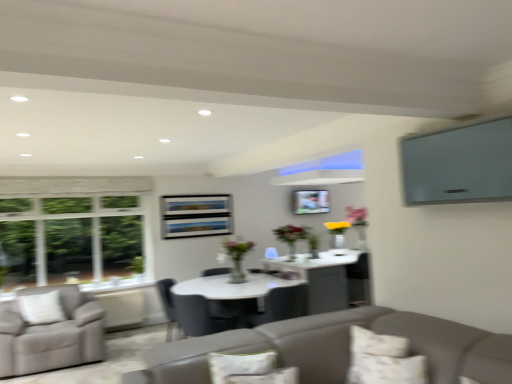
How much space does matte gray chair at center, which ranks as the 1th chair in right-to-left order, occupy horizontally?

It is 25.69 inches.

What is the approximate height of white textured pillow at lower right, which is the 1th pillow from right to left?

white textured pillow at lower right, which is the 1th pillow from right to left, is 11.19 inches tall.

In order to face matte black chair at center, the second chair when ordered from right to left, should I rotate leftwards or rightwards?

It's best to rotate left around 7.251 degrees.

You are a GUI agent. You are given a task and a screenshot of the screen. Output one action in this format:
    pyautogui.click(x=<x>, y=<y>)
    Task: Click on the fluffy white pillow at lower center, marked as the first pillow in a left-to-right arrangement
    Image resolution: width=512 pixels, height=384 pixels.
    Given the screenshot: What is the action you would take?
    pyautogui.click(x=266, y=377)

Is matte gray chair at center, which ranks as the 1th chair in right-to-left order, to the left or to the right of matte black chair at center, the second chair when ordered from right to left, in the image?

Clearly, matte gray chair at center, which ranks as the 1th chair in right-to-left order, is on the right of matte black chair at center, the second chair when ordered from right to left, in the image.

Locate an element on the screen. Image resolution: width=512 pixels, height=384 pixels. chair below the matte gray chair at center, which is counted as the second chair, starting from the left (from the image's perspective) is located at coordinates (191, 313).

Consider the image. Based on their sizes in the image, would you say matte gray chair at center, which ranks as the 1th chair in right-to-left order, is bigger or smaller than matte black chair at center, which is the first chair in left-to-right order?

matte gray chair at center, which ranks as the 1th chair in right-to-left order, is smaller than matte black chair at center, which is the first chair in left-to-right order.

Considering the positions of point (263, 314) and point (176, 295), is point (263, 314) closer or farther from the camera than point (176, 295)?

Point (263, 314) appears to be closer to the viewer than point (176, 295).

Is fluffy white pillow at lower center, arranged as the 2th pillow when viewed from the right, to the left of matte black chair at center, which is the first chair in left-to-right order, from the viewer's perspective?

Incorrect, fluffy white pillow at lower center, arranged as the 2th pillow when viewed from the right, is not on the left side of matte black chair at center, which is the first chair in left-to-right order.

Looking at this image, from a real-world perspective, which is physically below, fluffy white pillow at lower center, marked as the first pillow in a left-to-right arrangement, or matte black chair at center, the second chair when ordered from right to left?

From a 3D spatial view, matte black chair at center, the second chair when ordered from right to left, is below.

Is fluffy white pillow at lower center, arranged as the 2th pillow when viewed from the right, looking in the opposite direction of matte black chair at center, the second chair when ordered from right to left?

Yes, fluffy white pillow at lower center, arranged as the 2th pillow when viewed from the right, is positioned with its back facing matte black chair at center, the second chair when ordered from right to left.

Which object is closer to the camera, fluffy white pillow at lower center, marked as the first pillow in a left-to-right arrangement, or matte black chair at center, which is the first chair in left-to-right order?

fluffy white pillow at lower center, marked as the first pillow in a left-to-right arrangement, is more forward.

Is white textured pillow at lower right, which is the 1th pillow from right to left, surrounding matte black chair at center, which is the first chair in left-to-right order?

No, white textured pillow at lower right, which is the 1th pillow from right to left, does not contain matte black chair at center, which is the first chair in left-to-right order.

How different are the orientations of white textured pillow at lower right, which is the 1th pillow from right to left, and matte black chair at center, the second chair when ordered from right to left, in degrees?

169 degrees separate the facing orientations of white textured pillow at lower right, which is the 1th pillow from right to left, and matte black chair at center, the second chair when ordered from right to left.

I want to click on chair that is the 2nd object to the left of the white textured pillow at lower right, which is the 1th pillow from right to left, starting at the anchor, so click(x=191, y=313).

From a real-world perspective, is white textured pillow at lower right, which is the 1th pillow from right to left, under matte black chair at center, which is the first chair in left-to-right order?

Actually, white textured pillow at lower right, which is the 1th pillow from right to left, is physically above matte black chair at center, which is the first chair in left-to-right order, in the real world.

Is white textured pillow at lower right, the 2th pillow viewed from the left, far from matte gray chair at center, which ranks as the 1th chair in right-to-left order?

Indeed, white textured pillow at lower right, the 2th pillow viewed from the left, is not near matte gray chair at center, which ranks as the 1th chair in right-to-left order.

Which of these two, white textured pillow at lower right, which is the 1th pillow from right to left, or matte gray chair at center, which ranks as the 1th chair in right-to-left order, is smaller?

white textured pillow at lower right, which is the 1th pillow from right to left, is smaller.

Would you say white textured pillow at lower right, the 2th pillow viewed from the left, is inside or outside matte gray chair at center, which ranks as the 1th chair in right-to-left order?

white textured pillow at lower right, the 2th pillow viewed from the left, is not enclosed by matte gray chair at center, which ranks as the 1th chair in right-to-left order.

Which is more distant, (204, 299) or (293, 372)?

The point (204, 299) is farther.

Can you confirm if matte black chair at center, which is the first chair in left-to-right order, is positioned to the left of fluffy white pillow at lower center, arranged as the 2th pillow when viewed from the right?

Indeed, matte black chair at center, which is the first chair in left-to-right order, is positioned on the left side of fluffy white pillow at lower center, arranged as the 2th pillow when viewed from the right.

Considering the relative sizes of matte black chair at center, the second chair when ordered from right to left, and fluffy white pillow at lower center, arranged as the 2th pillow when viewed from the right, in the image provided, is matte black chair at center, the second chair when ordered from right to left, bigger than fluffy white pillow at lower center, arranged as the 2th pillow when viewed from the right,?

Indeed, matte black chair at center, the second chair when ordered from right to left, has a larger size compared to fluffy white pillow at lower center, arranged as the 2th pillow when viewed from the right.

From the image's perspective, which is below, matte black chair at center, which is the first chair in left-to-right order, or fluffy white pillow at lower center, marked as the first pillow in a left-to-right arrangement?

matte black chair at center, which is the first chair in left-to-right order.

Relative to white textured pillow at lower right, the 2th pillow viewed from the left, is matte black chair at center, which is the first chair in left-to-right order, in front or behind?

matte black chair at center, which is the first chair in left-to-right order, is behind white textured pillow at lower right, the 2th pillow viewed from the left.

Which is nearer, (198, 325) or (375, 350)?

The point (375, 350) is more forward.

Does matte black chair at center, the second chair when ordered from right to left, have a lesser height compared to white textured pillow at lower right, the 2th pillow viewed from the left?

In fact, matte black chair at center, the second chair when ordered from right to left, may be taller than white textured pillow at lower right, the 2th pillow viewed from the left.

Considering the sizes of matte black chair at center, which is the first chair in left-to-right order, and white textured pillow at lower right, which is the 1th pillow from right to left, in the image, is matte black chair at center, which is the first chair in left-to-right order, wider or thinner than white textured pillow at lower right, which is the 1th pillow from right to left,?

Clearly, matte black chair at center, which is the first chair in left-to-right order, has more width compared to white textured pillow at lower right, which is the 1th pillow from right to left.

Where is `pillow on the left side of white textured pillow at lower right, which is the 1th pillow from right to left`? The height and width of the screenshot is (384, 512). pillow on the left side of white textured pillow at lower right, which is the 1th pillow from right to left is located at coordinates (266, 377).

In the scene shown: From the image's perspective, is white textured pillow at lower right, which is the 1th pillow from right to left, above or below fluffy white pillow at lower center, arranged as the 2th pillow when viewed from the right?

white textured pillow at lower right, which is the 1th pillow from right to left, is below fluffy white pillow at lower center, arranged as the 2th pillow when viewed from the right.

Is white textured pillow at lower right, which is the 1th pillow from right to left, oriented away from fluffy white pillow at lower center, arranged as the 2th pillow when viewed from the right?

That's not correct — white textured pillow at lower right, which is the 1th pillow from right to left, is not looking away from fluffy white pillow at lower center, arranged as the 2th pillow when viewed from the right.

Considering the positions of objects white textured pillow at lower right, which is the 1th pillow from right to left, and fluffy white pillow at lower center, arranged as the 2th pillow when viewed from the right, in the image provided, who is more to the right, white textured pillow at lower right, which is the 1th pillow from right to left, or fluffy white pillow at lower center, arranged as the 2th pillow when viewed from the right,?

Positioned to the right is white textured pillow at lower right, which is the 1th pillow from right to left.

This screenshot has width=512, height=384. In order to click on chair above the matte black chair at center, the second chair when ordered from right to left (from the image's perspective) in this screenshot , I will do `click(282, 305)`.

Find the location of a particular element. This screenshot has height=384, width=512. the 2nd chair positioned below the fluffy white pillow at lower center, marked as the first pillow in a left-to-right arrangement (from a real-world perspective) is located at coordinates (191, 313).

Looking at the image, which one is located closer to matte gray chair at center, which ranks as the 1th chair in right-to-left order, matte black chair at center, the second chair when ordered from right to left, or fluffy white pillow at lower center, marked as the first pillow in a left-to-right arrangement?

The object closer to matte gray chair at center, which ranks as the 1th chair in right-to-left order, is matte black chair at center, the second chair when ordered from right to left.

Looking at the image, which one is located closer to matte gray chair at center, which ranks as the 1th chair in right-to-left order, white textured pillow at lower right, the 2th pillow viewed from the left, or fluffy white pillow at lower center, arranged as the 2th pillow when viewed from the right?

white textured pillow at lower right, the 2th pillow viewed from the left, is positioned closer to the anchor matte gray chair at center, which ranks as the 1th chair in right-to-left order.

When comparing their distances from white textured pillow at lower right, the 2th pillow viewed from the left, does matte black chair at center, which is the first chair in left-to-right order, or fluffy white pillow at lower center, marked as the first pillow in a left-to-right arrangement, seem further?

Based on the image, matte black chair at center, which is the first chair in left-to-right order, appears to be further to white textured pillow at lower right, the 2th pillow viewed from the left.

Which object lies nearer to the anchor point matte gray chair at center, which ranks as the 1th chair in right-to-left order, matte black chair at center, which is the first chair in left-to-right order, or white textured pillow at lower right, which is the 1th pillow from right to left?

The object closer to matte gray chair at center, which ranks as the 1th chair in right-to-left order, is matte black chair at center, which is the first chair in left-to-right order.

When comparing their distances from matte black chair at center, the second chair when ordered from right to left, does matte gray chair at center, which is counted as the second chair, starting from the left, or fluffy white pillow at lower center, marked as the first pillow in a left-to-right arrangement, seem closer?

matte gray chair at center, which is counted as the second chair, starting from the left, is positioned closer to the anchor matte black chair at center, the second chair when ordered from right to left.

Which object lies further to the anchor point fluffy white pillow at lower center, marked as the first pillow in a left-to-right arrangement, matte gray chair at center, which is counted as the second chair, starting from the left, or white textured pillow at lower right, which is the 1th pillow from right to left?

matte gray chair at center, which is counted as the second chair, starting from the left, lies further to fluffy white pillow at lower center, marked as the first pillow in a left-to-right arrangement, than the other object.

Considering their positions, is matte gray chair at center, which is counted as the second chair, starting from the left, positioned closer to fluffy white pillow at lower center, marked as the first pillow in a left-to-right arrangement, than matte black chair at center, the second chair when ordered from right to left?

Based on the image, matte gray chair at center, which is counted as the second chair, starting from the left, appears to be nearer to fluffy white pillow at lower center, marked as the first pillow in a left-to-right arrangement.

Based on their spatial positions, is fluffy white pillow at lower center, marked as the first pillow in a left-to-right arrangement, or matte gray chair at center, which is counted as the second chair, starting from the left, closer to white textured pillow at lower right, the 2th pillow viewed from the left?

Based on the image, fluffy white pillow at lower center, marked as the first pillow in a left-to-right arrangement, appears to be nearer to white textured pillow at lower right, the 2th pillow viewed from the left.

Locate an element on the screen. The image size is (512, 384). chair between white textured pillow at lower right, which is the 1th pillow from right to left, and matte gray chair at center, which ranks as the 1th chair in right-to-left order, in the front-back direction is located at coordinates (191, 313).

The image size is (512, 384). In order to click on chair located between fluffy white pillow at lower center, marked as the first pillow in a left-to-right arrangement, and matte gray chair at center, which ranks as the 1th chair in right-to-left order, in the depth direction in this screenshot , I will do `click(191, 313)`.

Where is `pillow positioned between fluffy white pillow at lower center, marked as the first pillow in a left-to-right arrangement, and matte gray chair at center, which ranks as the 1th chair in right-to-left order, from near to far`? pillow positioned between fluffy white pillow at lower center, marked as the first pillow in a left-to-right arrangement, and matte gray chair at center, which ranks as the 1th chair in right-to-left order, from near to far is located at coordinates (383, 360).

This screenshot has width=512, height=384. Identify the location of pillow positioned between fluffy white pillow at lower center, marked as the first pillow in a left-to-right arrangement, and matte black chair at center, the second chair when ordered from right to left, from near to far. (383, 360).